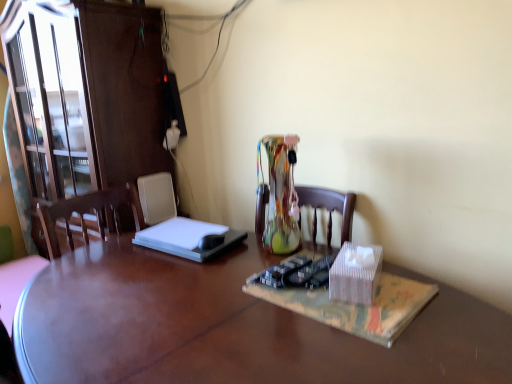
Question: Are wooden desk at center and translucent plastic book at center located far from each other?

Choices:
 (A) yes
 (B) no

Answer: (B)

Question: Considering the relative sizes of wooden desk at center and translucent plastic book at center in the image provided, is wooden desk at center smaller than translucent plastic book at center?

Choices:
 (A) no
 (B) yes

Answer: (A)

Question: Is the depth of wooden desk at center less than that of translucent plastic book at center?

Choices:
 (A) no
 (B) yes

Answer: (B)

Question: From the image's perspective, does wooden desk at center appear lower than translucent plastic book at center?

Choices:
 (A) yes
 (B) no

Answer: (A)

Question: Could you tell me if wooden desk at center is facing translucent plastic book at center?

Choices:
 (A) no
 (B) yes

Answer: (A)

Question: Is wooden desk at center oriented away from translucent plastic book at center?

Choices:
 (A) no
 (B) yes

Answer: (A)

Question: Is translucent plastic book at center wider than wooden desk at center?

Choices:
 (A) no
 (B) yes

Answer: (A)

Question: Does translucent plastic book at center have a lesser width compared to wooden desk at center?

Choices:
 (A) yes
 (B) no

Answer: (A)

Question: Is translucent plastic book at center at the left side of wooden desk at center?

Choices:
 (A) yes
 (B) no

Answer: (B)

Question: Does translucent plastic book at center lie behind wooden desk at center?

Choices:
 (A) no
 (B) yes

Answer: (B)

Question: Is wooden desk at center inside translucent plastic book at center?

Choices:
 (A) yes
 (B) no

Answer: (B)

Question: Can you confirm if translucent plastic book at center is shorter than wooden desk at center?

Choices:
 (A) no
 (B) yes

Answer: (B)

Question: Is white cardboard box at center in front of matte brown cabinet at left?

Choices:
 (A) yes
 (B) no

Answer: (A)